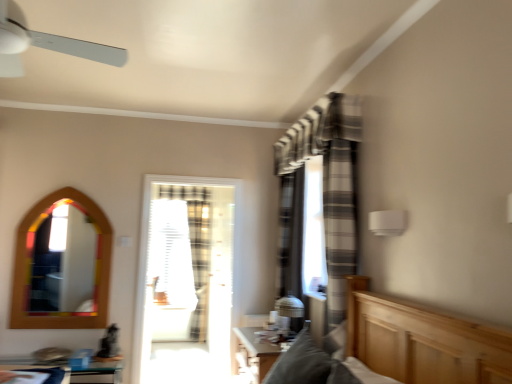
Identify the location of vacant point above translucent glass door at center (from a real-world perspective). The height and width of the screenshot is (384, 512). 194,182.